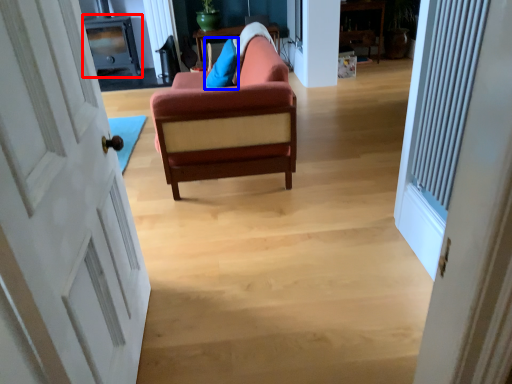
Question: Among these objects, which one is farthest to the camera, entertainment center (highlighted by a red box) or pillow (highlighted by a blue box)?

Choices:
 (A) entertainment center
 (B) pillow

Answer: (A)